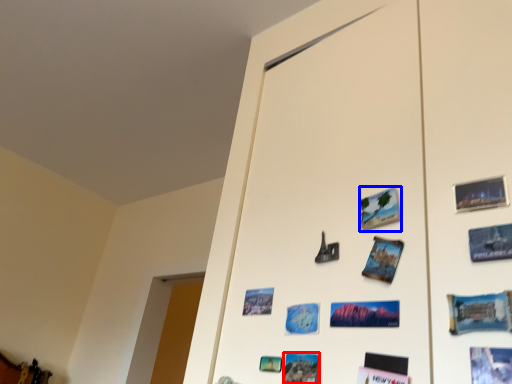
Question: Among these objects, which one is farthest to the camera, postcard (highlighted by a red box) or postcard (highlighted by a blue box)?

Choices:
 (A) postcard
 (B) postcard

Answer: (B)